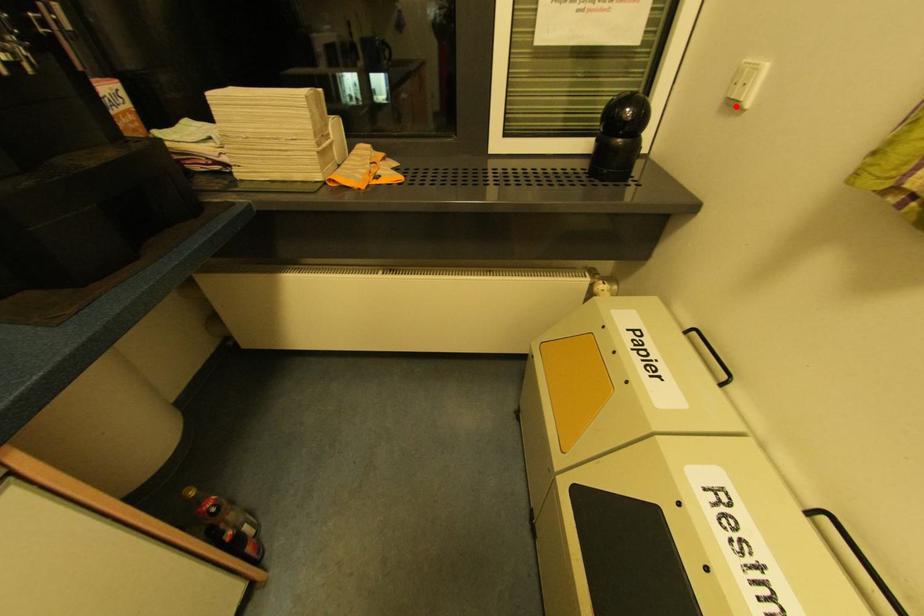
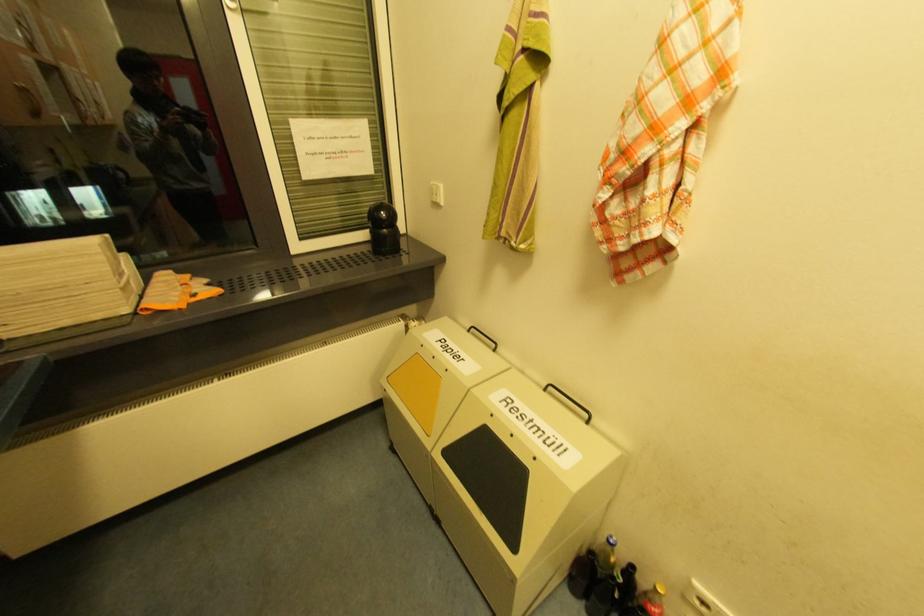
Find the pixel in the second image that matches the highlighted location in the first image.

(440, 205)